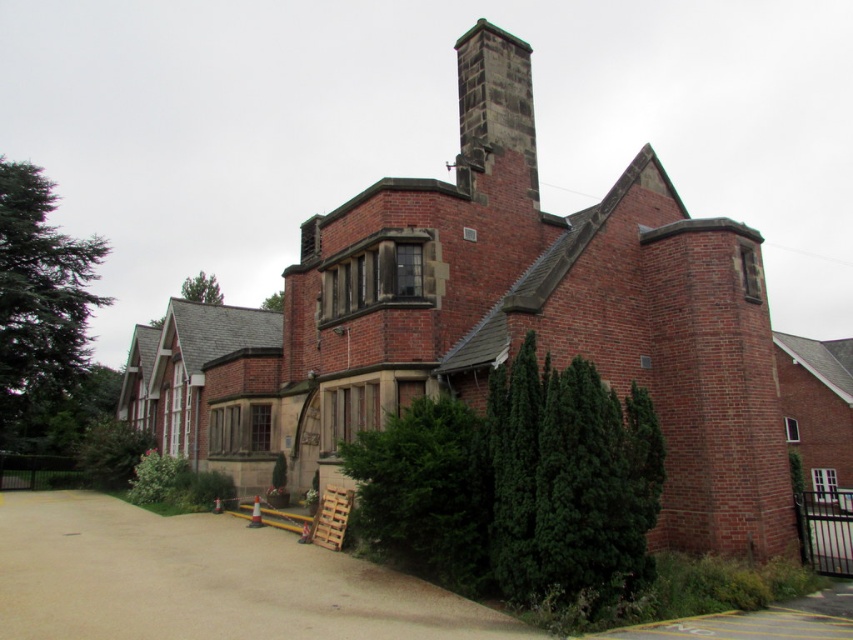
Between red brick church at center and dark gray stone chimney at upper center, which one has less height?

With less height is dark gray stone chimney at upper center.

You are a GUI agent. You are given a task and a screenshot of the screen. Output one action in this format:
    pyautogui.click(x=<x>, y=<y>)
    Task: Click on the red brick church at center
    This screenshot has height=640, width=853.
    Given the screenshot: What is the action you would take?
    pyautogui.click(x=491, y=337)

Does point (273, 451) come closer to viewer compared to point (537, 189)?

No, it is not.

This screenshot has height=640, width=853. I want to click on red brick church at center, so pyautogui.click(x=491, y=337).

Is the position of brown gravel driveway at lower left more distant than that of dark gray stone chimney at upper center?

No, it is not.

Can you confirm if brown gravel driveway at lower left is positioned below dark gray stone chimney at upper center?

Yes, brown gravel driveway at lower left is below dark gray stone chimney at upper center.

I want to click on brown gravel driveway at lower left, so (204, 580).

Identify the location of brown gravel driveway at lower left. (204, 580).

Between point (189, 406) and point (276, 630), which one is positioned behind?

Point (189, 406)

Measure the distance between red brick church at center and brown gravel driveway at lower left.

The distance of red brick church at center from brown gravel driveway at lower left is 7.08 meters.

Measure the distance between point (659, 214) and camera.

Point (659, 214) is 19.75 meters from camera.

Identify the location of red brick church at center. (491, 337).